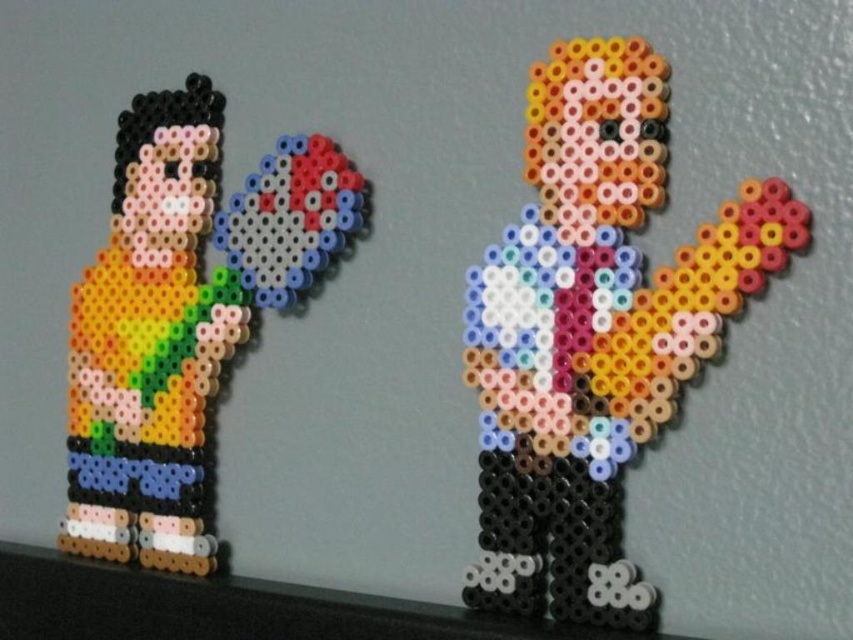
Based on the coordinates provided, which figure is located at point (595, 332)?

The point (595, 332) indicates the multicolored beads man at center.

You are an artist who wants to create a new figure using the multicolored beads man at center and the multicolored beads at left. If you want to make a taller figure, which beads should you use?

The multicolored beads at left are taller than the multicolored beads man at center, so you should use the multicolored beads at left to create a taller figure.